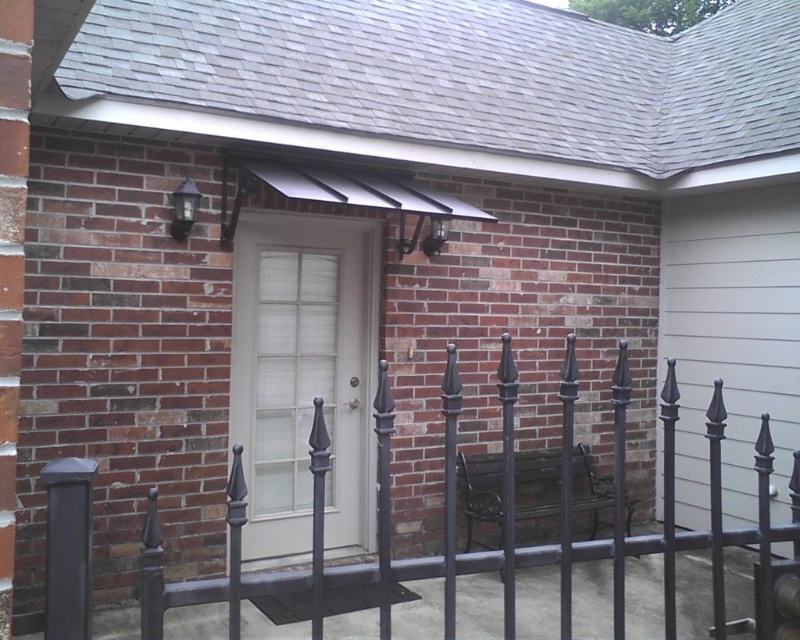
Does point (312, 579) lie in front of point (356, 545)?

Yes.

Does point (478, 552) lie in front of point (284, 492)?

Yes.

Locate an element on the screen. black wrought iron fence at center is located at coordinates (502, 522).